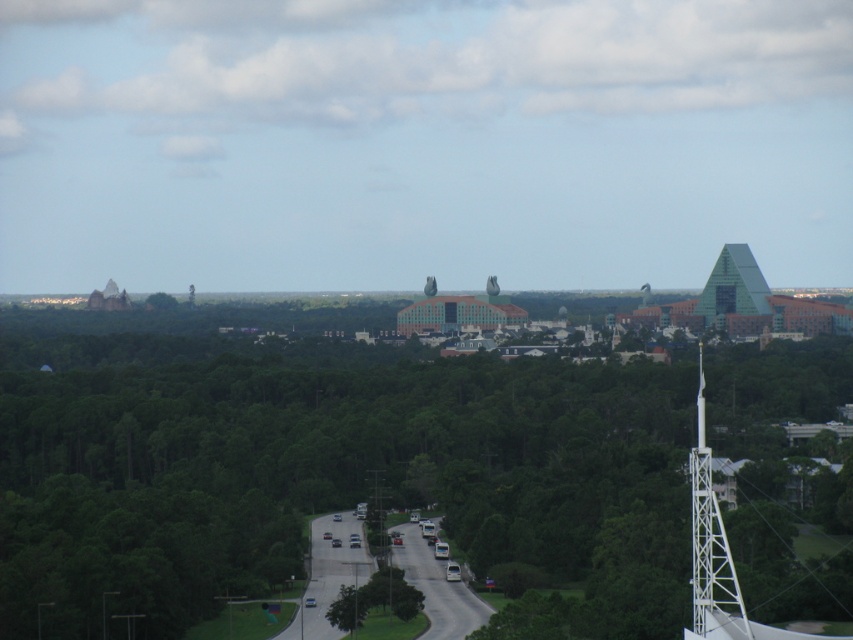
Is white metallic tower at right thinner than green glass pyramid at upper right?

Yes, white metallic tower at right is thinner than green glass pyramid at upper right.

The image size is (853, 640). I want to click on white metallic tower at right, so click(711, 548).

The width and height of the screenshot is (853, 640). Find the location of `white metallic tower at right`. white metallic tower at right is located at coordinates (711, 548).

Which is in front, point (755, 300) or point (340, 612)?

Point (340, 612) is more forward.

Image resolution: width=853 pixels, height=640 pixels. What do you see at coordinates (733, 285) in the screenshot? I see `green glass pyramid at upper right` at bounding box center [733, 285].

Image resolution: width=853 pixels, height=640 pixels. I want to click on green glass pyramid at upper right, so click(x=733, y=285).

Who is more distant from viewer, (x=697, y=522) or (x=338, y=605)?

The point (x=697, y=522) is more distant.

Find the location of a particular element. This screenshot has height=640, width=853. white metallic tower at right is located at coordinates (711, 548).

Locate an element on the screen. white metallic tower at right is located at coordinates (711, 548).